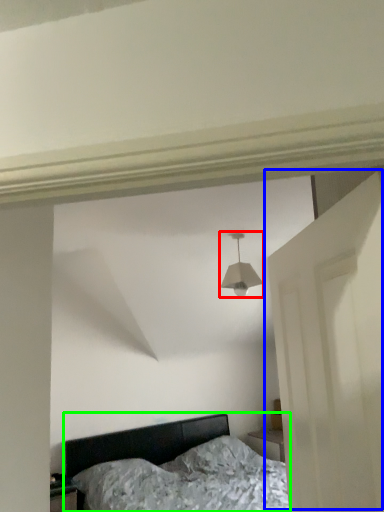
Question: Which object is positioned closest to lamp (highlighted by a red box)? Select from door (highlighted by a blue box) and bed (highlighted by a green box).

Choices:
 (A) door
 (B) bed

Answer: (A)